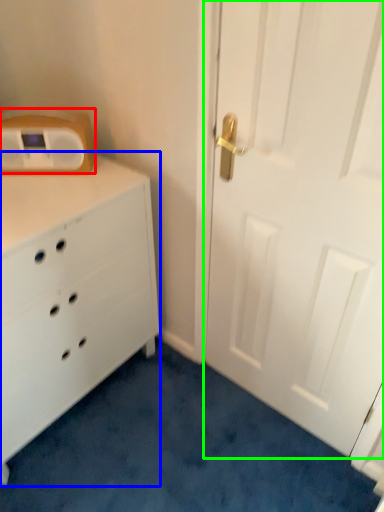
Question: Based on their relative distances, which object is farther from appliance (highlighted by a red box)? Choose from chest of drawers (highlighted by a blue box) and door (highlighted by a green box).

Choices:
 (A) chest of drawers
 (B) door

Answer: (B)